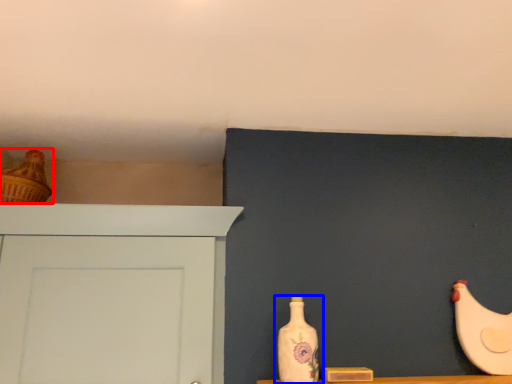
Question: Which of the following is the farthest to the observer, chicken (highlighted by a red box) or bottle (highlighted by a blue box)?

Choices:
 (A) chicken
 (B) bottle

Answer: (A)